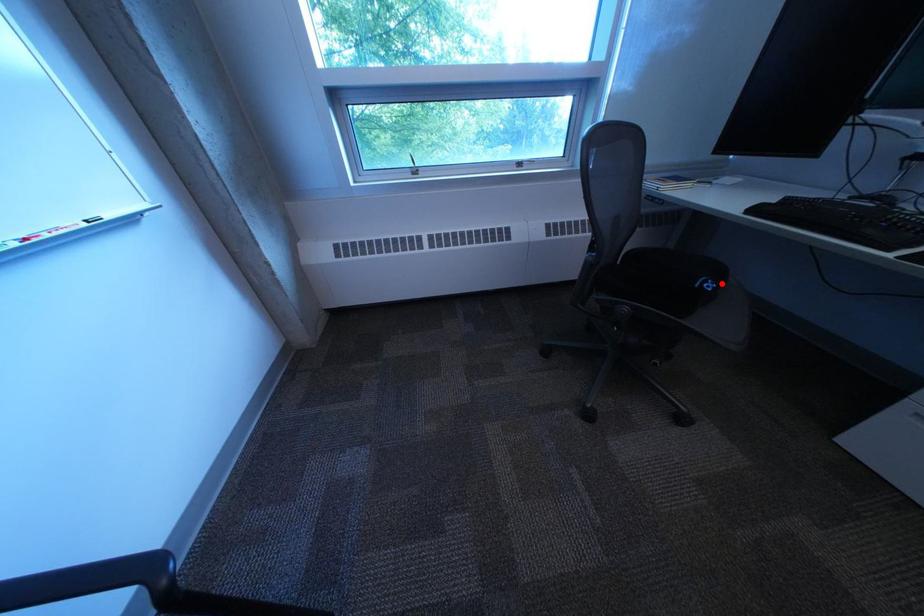
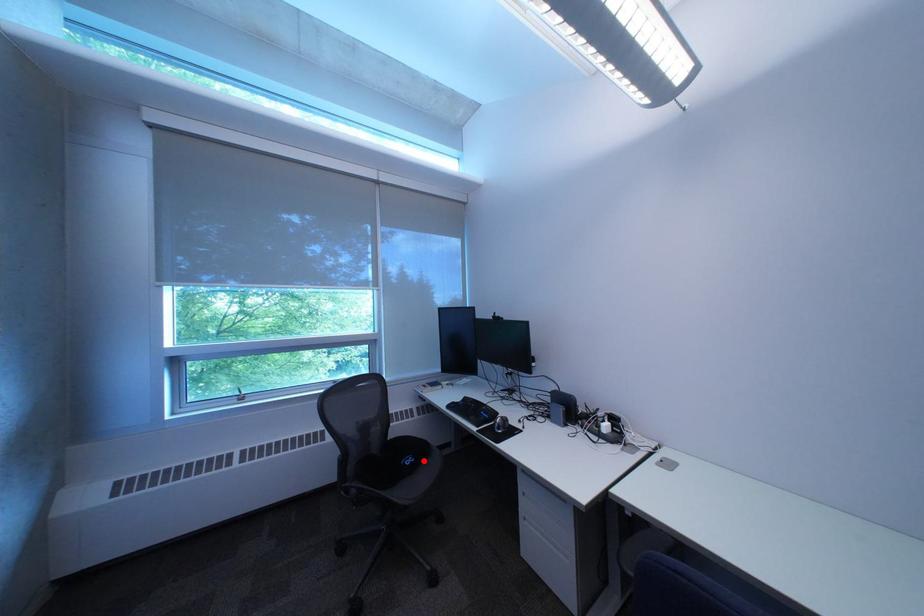
Based on the photo, I am providing you with two images of the same scene from different viewpoints. A red point is marked on the first image and another point is marked on the second image. Is the marked point in image1 the same physical position as the marked point in image2?

Yes